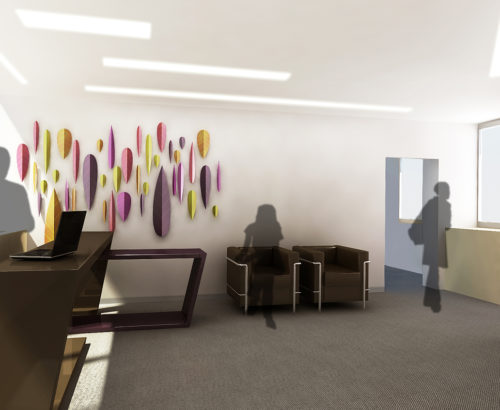
Image resolution: width=500 pixels, height=410 pixels. I want to click on laptop keyboard, so [39, 254].